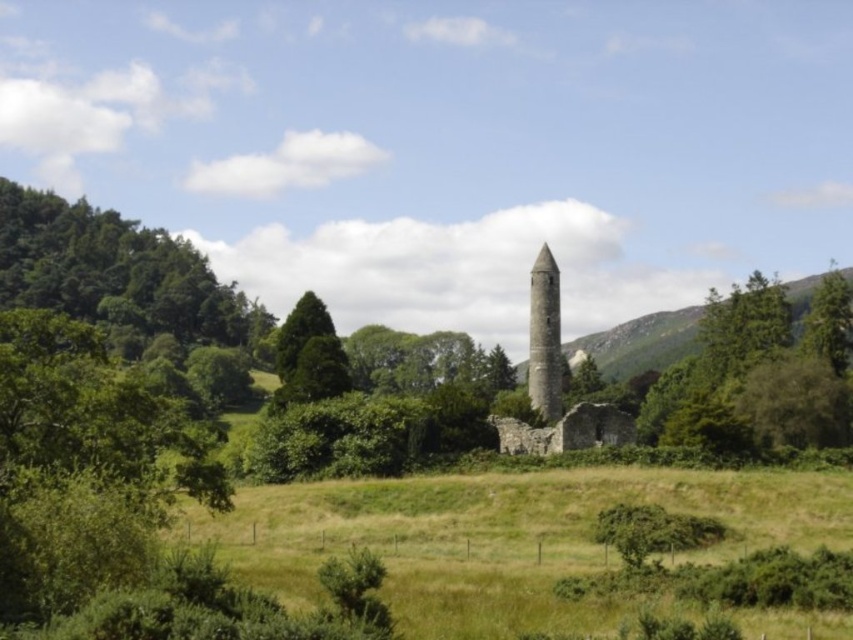
Can you confirm if green grassy field at center is thinner than green leafy tree at left?

Yes, green grassy field at center is thinner than green leafy tree at left.

Can you confirm if green grassy field at center is positioned to the right of green leafy tree at left?

Yes, green grassy field at center is to the right of green leafy tree at left.

Which is in front, point (732, 518) or point (186, 305)?

Positioned in front is point (732, 518).

Image resolution: width=853 pixels, height=640 pixels. In order to click on green grassy field at center in this screenshot , I will do `click(502, 538)`.

Who is higher up, green grassy field at center or green leafy tree at right?

green leafy tree at right is above.

Can you confirm if green grassy field at center is positioned to the left of green leafy tree at right?

Indeed, green grassy field at center is positioned on the left side of green leafy tree at right.

The height and width of the screenshot is (640, 853). Describe the element at coordinates (502, 538) in the screenshot. I see `green grassy field at center` at that location.

Where is `green grassy field at center`? Image resolution: width=853 pixels, height=640 pixels. green grassy field at center is located at coordinates (x=502, y=538).

How far apart are stone tower at center and green leafy tree at right?

stone tower at center is 38.65 meters from green leafy tree at right.

Is point (612, 428) positioned behind point (840, 307)?

No, it is in front of (840, 307).

Is point (549, 406) positioned after point (822, 349)?

No, (549, 406) is closer to viewer.

Locate an element on the screen. stone tower at center is located at coordinates (555, 385).